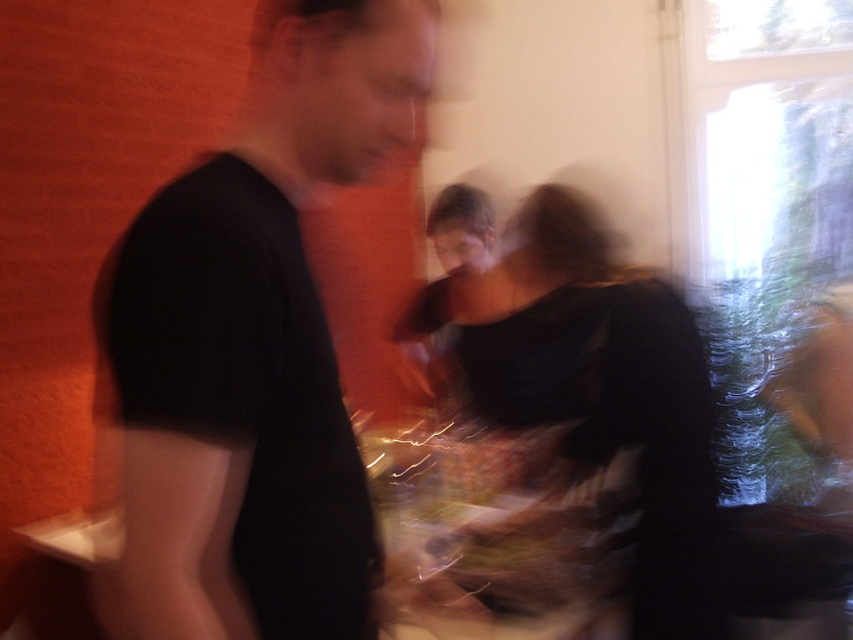
You are organizing a photo shoot and need to ensure proper spacing between two subjects. The black matte shirt at left and the matte black dress at center are part of the setup. Given that the minimum required distance for clear photography is 30 inches, can the current spacing between them meet this requirement?

The black matte shirt at left and the matte black dress at center are 29.32 inches apart from each other, which is slightly less than the required 30 inches. Therefore, the current spacing does not meet the minimum distance requirement for clear photography.

You are at a party and want to find the matte black dress at center. Which direction should you look relative to the black matte shirt at left?

The black matte shirt at left is above the matte black dress at center, so you should look downward from the black matte shirt at left to find the matte black dress at center.